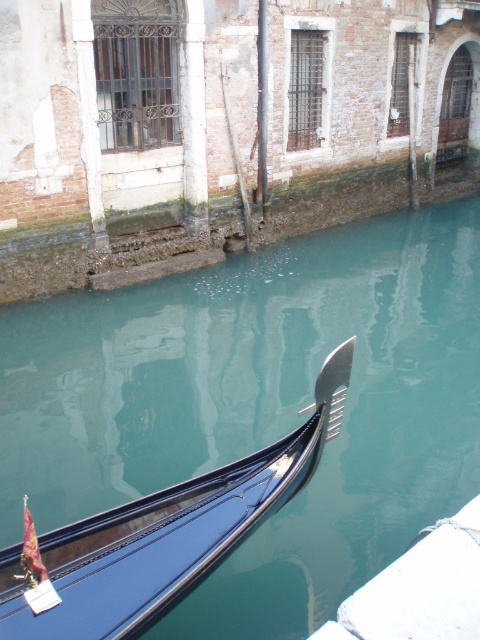
Between glossy teal water at center and shiny black gondola at lower left, which one has more height?

glossy teal water at center is taller.

You are a GUI agent. You are given a task and a screenshot of the screen. Output one action in this format:
    pyautogui.click(x=<x>, y=<y>)
    Task: Click on the glossy teal water at center
    The height and width of the screenshot is (640, 480).
    Given the screenshot: What is the action you would take?
    pyautogui.click(x=260, y=404)

Where is `glossy teal water at center`? This screenshot has height=640, width=480. glossy teal water at center is located at coordinates (260, 404).